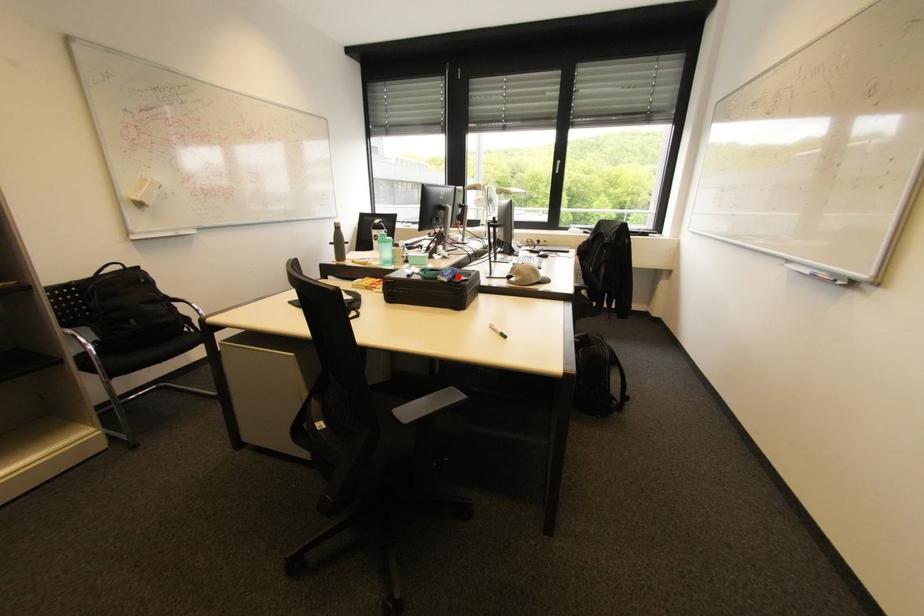
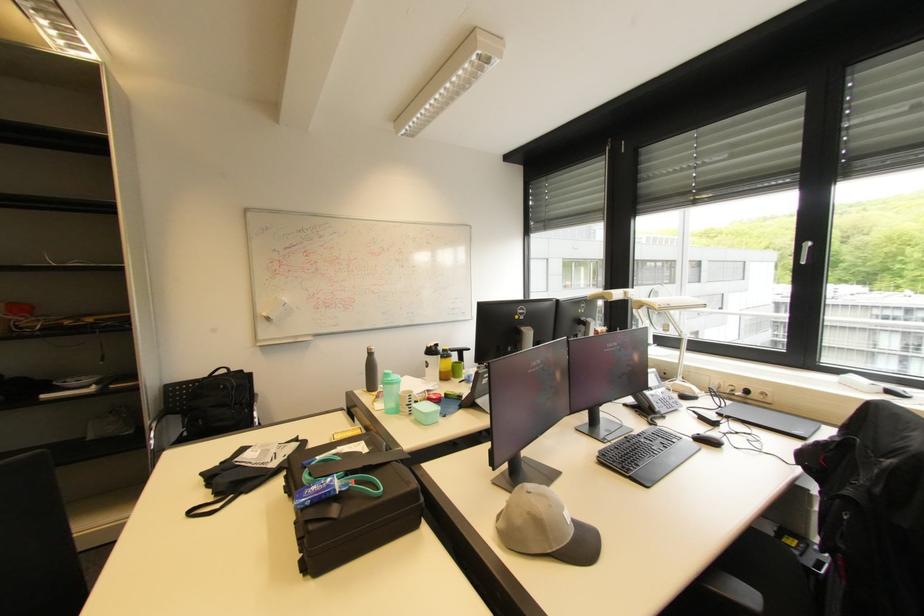
Locate, in the second image, the point that corresponds to the highlighted location in the first image.

(321, 501)